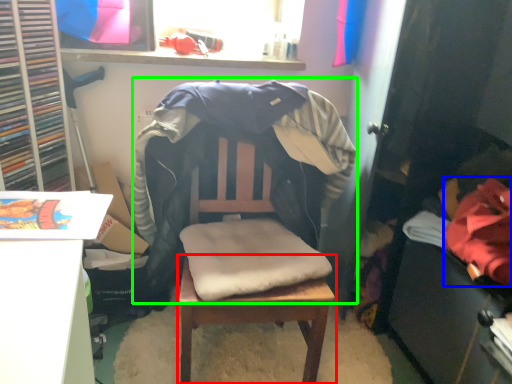
Question: Which object is the closest to the table (highlighted by a red box)? Choose among these: clothing (highlighted by a blue box) or bean bag chair (highlighted by a green box).

Choices:
 (A) clothing
 (B) bean bag chair

Answer: (B)